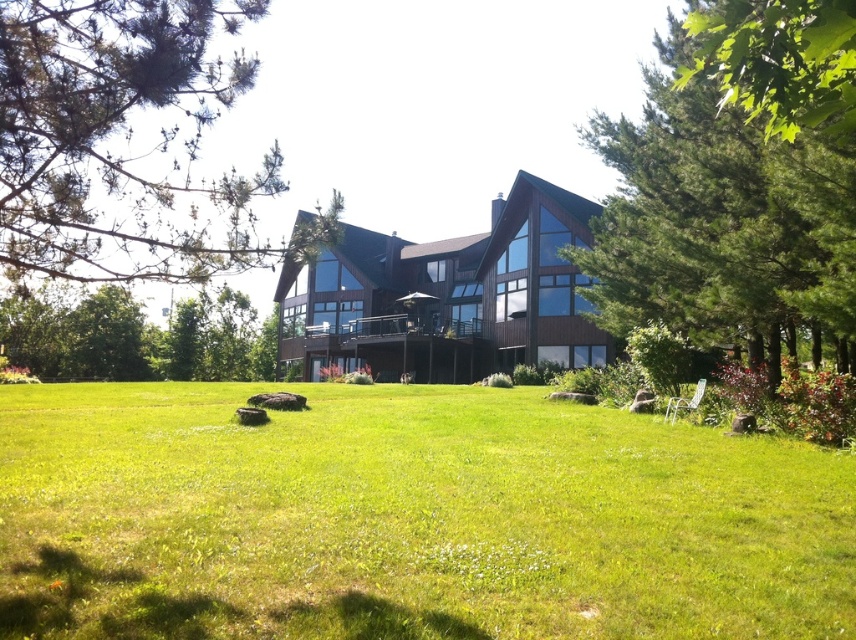
Question: Which object appears farthest from the camera in this image?

Choices:
 (A) green needle-like leaves at upper left
 (B) green leafy tree at right

Answer: (A)

Question: In this image, where is green needle-like leaves at upper left located relative to green leafy tree at lower left?

Choices:
 (A) left
 (B) right

Answer: (B)

Question: Is green grass at center further to the viewer compared to green leafy tree at lower left?

Choices:
 (A) yes
 (B) no

Answer: (B)

Question: Among these points, which one is farthest from the camera?

Choices:
 (A) (69, 83)
 (B) (625, 179)
 (C) (271, 378)
 (D) (804, 74)

Answer: (C)

Question: Which of the following is the farthest from the observer?

Choices:
 (A) (842, 300)
 (B) (829, 115)
 (C) (152, 176)

Answer: (A)

Question: Is green leafy tree at right further to camera compared to green leafy tree at upper right?

Choices:
 (A) yes
 (B) no

Answer: (A)